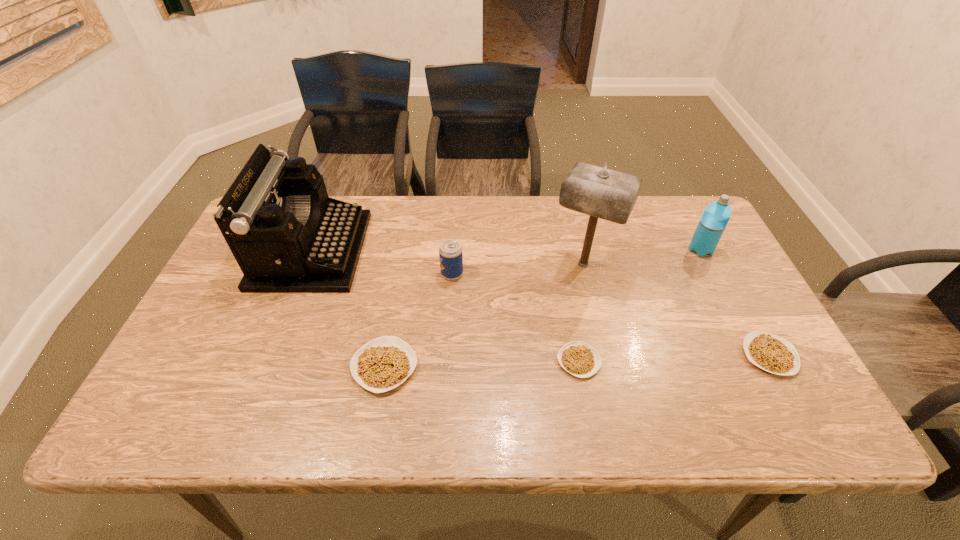
What are the coordinates of `the fourth shortest object` in the screenshot? It's located at (450, 251).

This screenshot has width=960, height=540. Identify the location of the third object from left to right. (450, 251).

At what (x,y) coordinates should I click in order to perform the action: click on free space located 0.140m on the right of the fifth tallest object. Please return your answer as a coordinate pair (x, y). Looking at the image, I should click on (478, 367).

What are the coordinates of `vacant space located 0.360m on the right of the second legume from left to right` in the screenshot? It's located at (754, 361).

At what (x,y) coordinates should I click in order to perform the action: click on free space located on the back of the rightmost legume. Please return your answer as a coordinate pair (x, y). This screenshot has width=960, height=540. Looking at the image, I should click on (738, 298).

Locate an element on the screen. This screenshot has height=540, width=960. free spot located 0.200m on the front of the mallet is located at coordinates (603, 347).

Find the location of a particular element. The width and height of the screenshot is (960, 540). vacant region located 0.380m on the typing side of the sixth shortest object is located at coordinates (491, 251).

The image size is (960, 540). What are the coordinates of `vacant area situated 0.340m on the front of the fifth shortest object` in the screenshot? It's located at (755, 357).

Where is `blank space located on the left of the fourth tallest object`? blank space located on the left of the fourth tallest object is located at coordinates (301, 274).

The image size is (960, 540). Find the location of `typewriter present at the far edge`. typewriter present at the far edge is located at coordinates (287, 235).